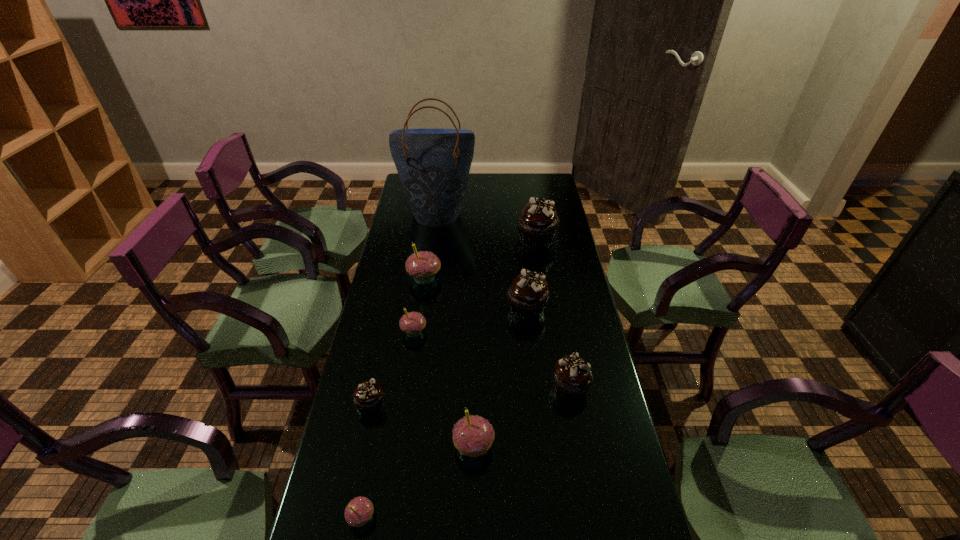
Locate an element on the screen. This screenshot has height=540, width=960. the second smallest brown cupcake is located at coordinates (572, 378).

Find the location of `the smallest brown cupcake`. the smallest brown cupcake is located at coordinates (367, 397).

Locate an element on the screen. This screenshot has height=540, width=960. the nearest cupcake is located at coordinates (358, 512).

You are a GUI agent. You are given a task and a screenshot of the screen. Output one action in this format:
    pyautogui.click(x=<x>, y=<y>)
    Task: Click on the nearest pink cupcake
    The image size is (960, 540).
    Given the screenshot: What is the action you would take?
    pyautogui.click(x=358, y=512)

The image size is (960, 540). In order to click on vacant region located on the right of the farthest object in this screenshot , I will do `click(560, 213)`.

The height and width of the screenshot is (540, 960). What are the coordinates of `vacant space located on the back of the farthest cupcake` in the screenshot? It's located at (532, 214).

Locate an element on the screen. Image resolution: width=960 pixels, height=540 pixels. free space located 0.270m on the front of the farthest pink cupcake is located at coordinates (415, 347).

Where is `vacant area located on the right of the second farthest brown cupcake`? vacant area located on the right of the second farthest brown cupcake is located at coordinates (564, 309).

Identify the location of vacant space situated 0.230m on the back of the third farthest pink cupcake. (474, 360).

This screenshot has height=540, width=960. In order to click on free space located on the right of the second farthest pink cupcake in this screenshot , I will do `click(548, 332)`.